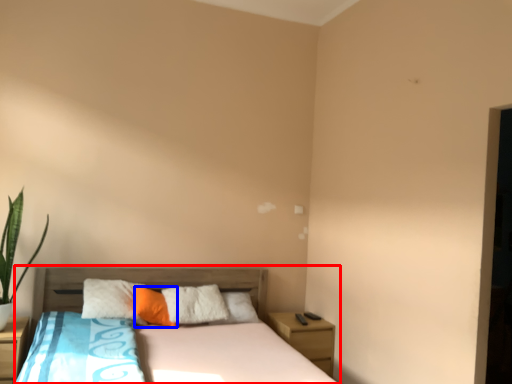
Question: Which of the following is the closest to the observer, bed (highlighted by a red box) or pillow (highlighted by a blue box)?

Choices:
 (A) bed
 (B) pillow

Answer: (A)